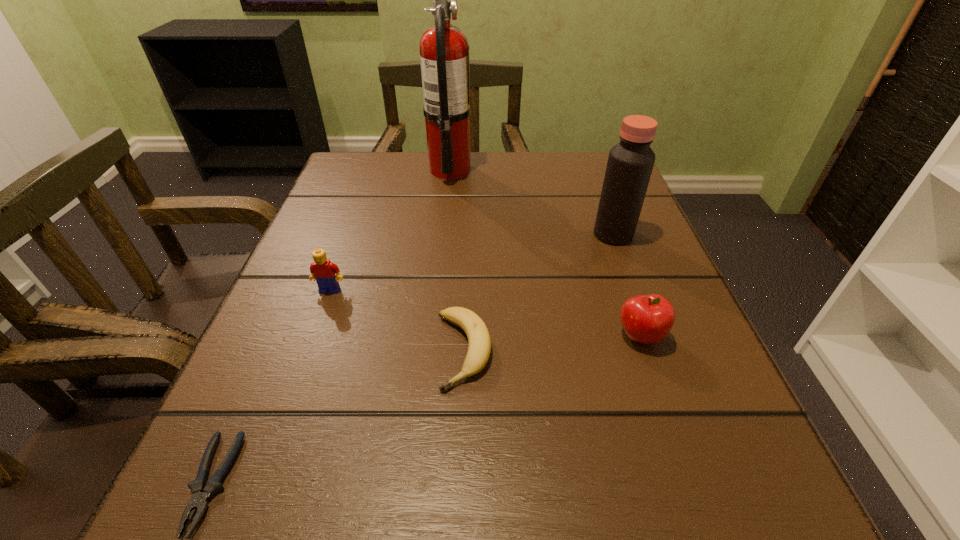
You are a GUI agent. You are given a task and a screenshot of the screen. Output one action in this format:
    pyautogui.click(x=<x>, y=<y>)
    Task: Click on the farthest object
    This screenshot has height=540, width=960.
    Given the screenshot: What is the action you would take?
    pyautogui.click(x=444, y=57)

Image resolution: width=960 pixels, height=540 pixels. In order to click on the tallest object in this screenshot , I will do `click(444, 57)`.

This screenshot has height=540, width=960. I want to click on the second farthest object, so click(630, 163).

Where is `the fifth shortest object`? the fifth shortest object is located at coordinates (630, 163).

Find the location of a particular element. the fourth nearest object is located at coordinates (322, 269).

Locate an element on the screen. Lego is located at coordinates (322, 269).

At what (x,y) coordinates should I click in order to perform the action: click on apple. Please return your answer as a coordinate pair (x, y). Looking at the image, I should click on (647, 319).

Where is `banana`? banana is located at coordinates (479, 342).

The image size is (960, 540). What are the coordinates of `vacant space situated on the nozzle side of the tallest object` in the screenshot? It's located at (540, 170).

At what (x,y) coordinates should I click in order to perform the action: click on vacant space located 0.390m on the left of the second tallest object. Please return your answer as a coordinate pair (x, y). Looking at the image, I should click on coord(390,234).